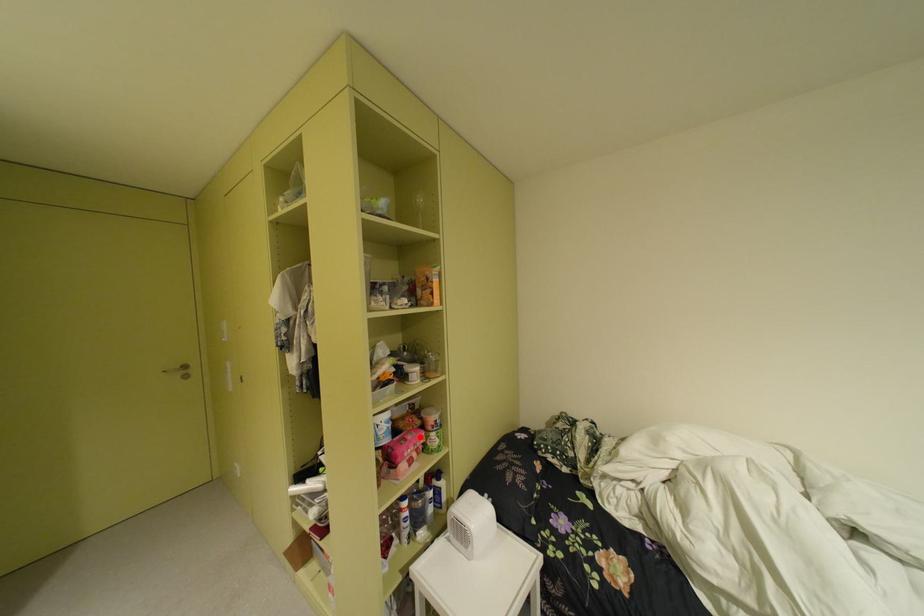
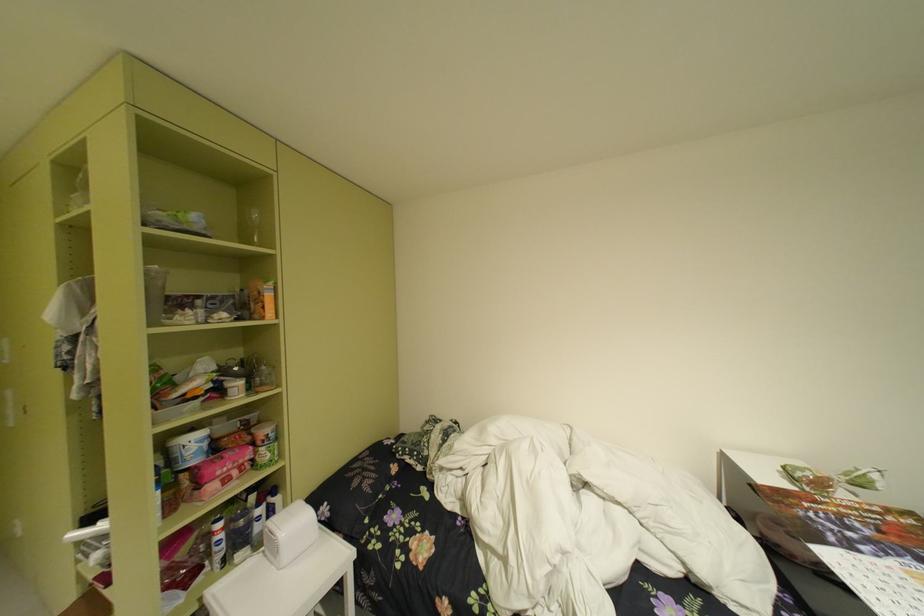
In the second image, find the point that corresponds to the highlighted location in the first image.

(238, 455)